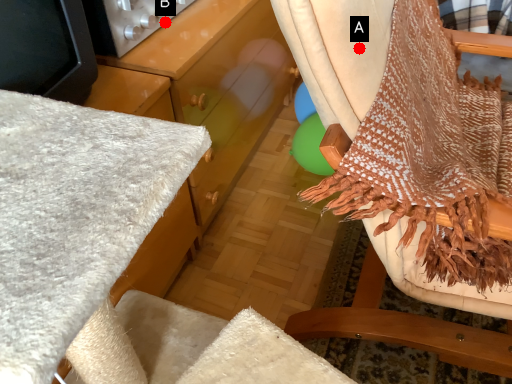
Question: Two points are circled on the image, labeled by A and B beside each circle. Which point appears farthest from the camera in this image?

Choices:
 (A) A is further
 (B) B is further

Answer: (B)